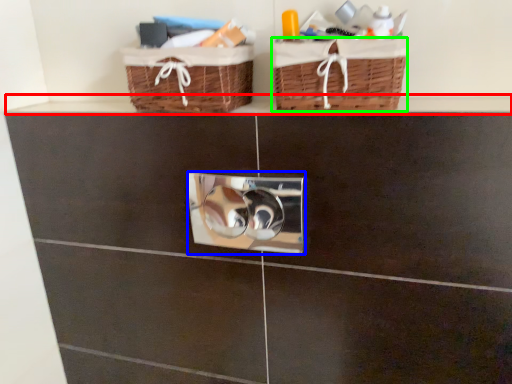
Question: Considering the real-world distances, which object is closest to ledge (highlighted by a red box)? lock (highlighted by a blue box) or basket (highlighted by a green box).

Choices:
 (A) lock
 (B) basket

Answer: (A)